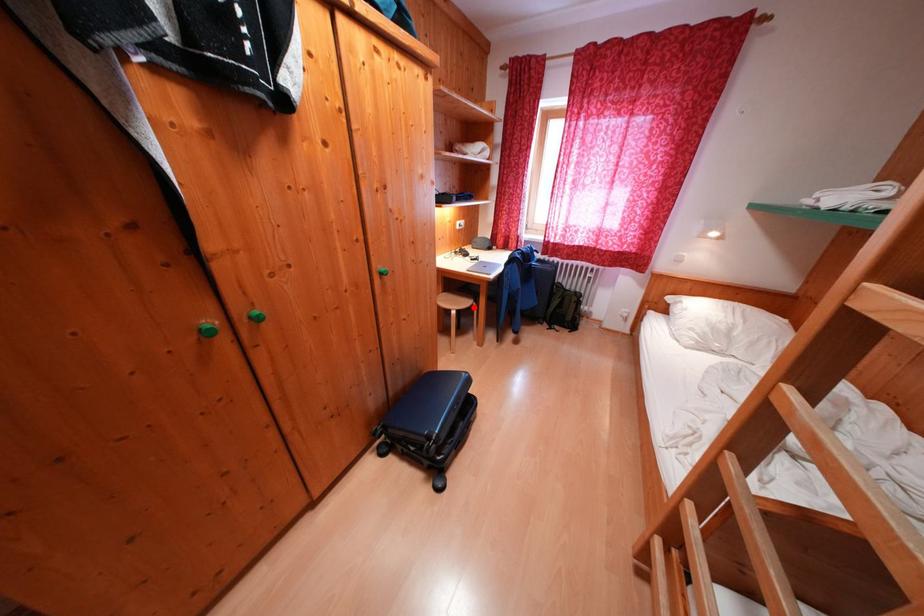
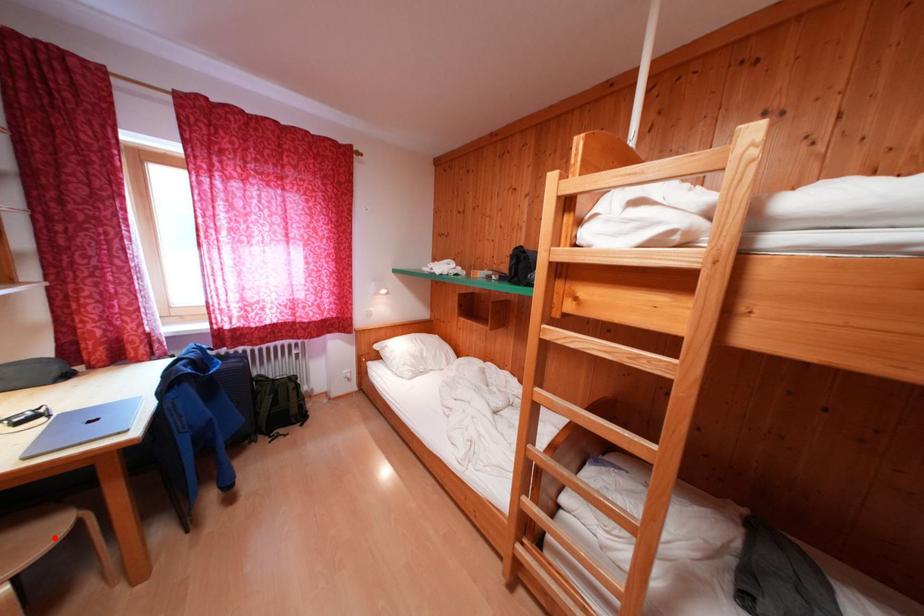
I am providing you with two images of the same scene from different viewpoints. A red point is marked on the first image and another point is marked on the second image. Is the marked point in image1 the same physical position as the marked point in image2?

Yes